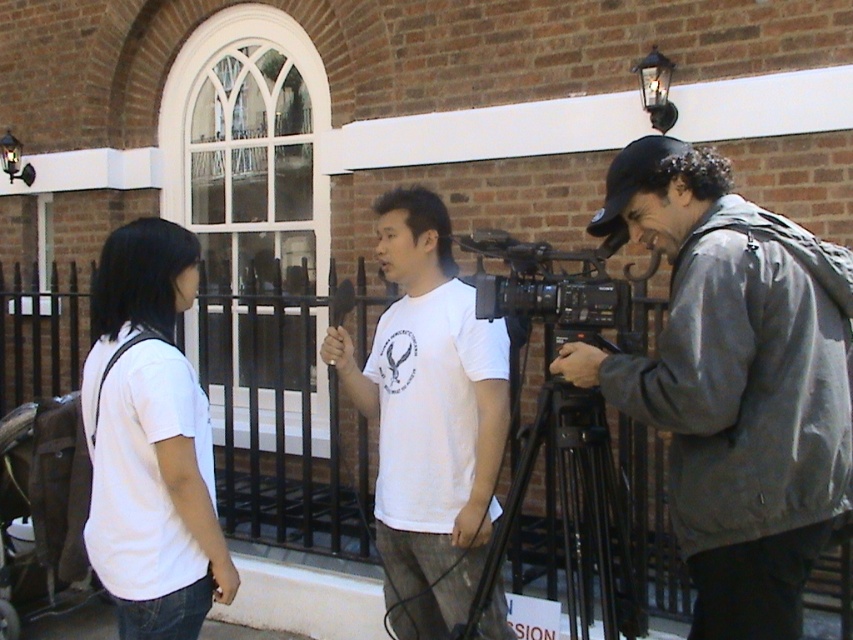
Question: Is the position of white matte t-shirt at center more distant than that of white matte t-shirt at left?

Choices:
 (A) no
 (B) yes

Answer: (B)

Question: Is black metal tripod at center closer to the viewer compared to black plastic video camera at center?

Choices:
 (A) no
 (B) yes

Answer: (B)

Question: Which object is closer to the camera taking this photo?

Choices:
 (A) white matte t-shirt at left
 (B) black plastic video camera at center
 (C) gray fabric jacket at right

Answer: (C)

Question: Is the position of gray fabric jacket at right more distant than that of black plastic video camera at center?

Choices:
 (A) yes
 (B) no

Answer: (B)

Question: Among these points, which one is nearest to the camera?

Choices:
 (A) (712, 572)
 (B) (100, 364)
 (C) (412, 508)

Answer: (A)

Question: Which of the following is the farthest from the observer?

Choices:
 (A) (410, 416)
 (B) (564, 433)
 (C) (618, 316)
 (D) (112, 385)

Answer: (A)